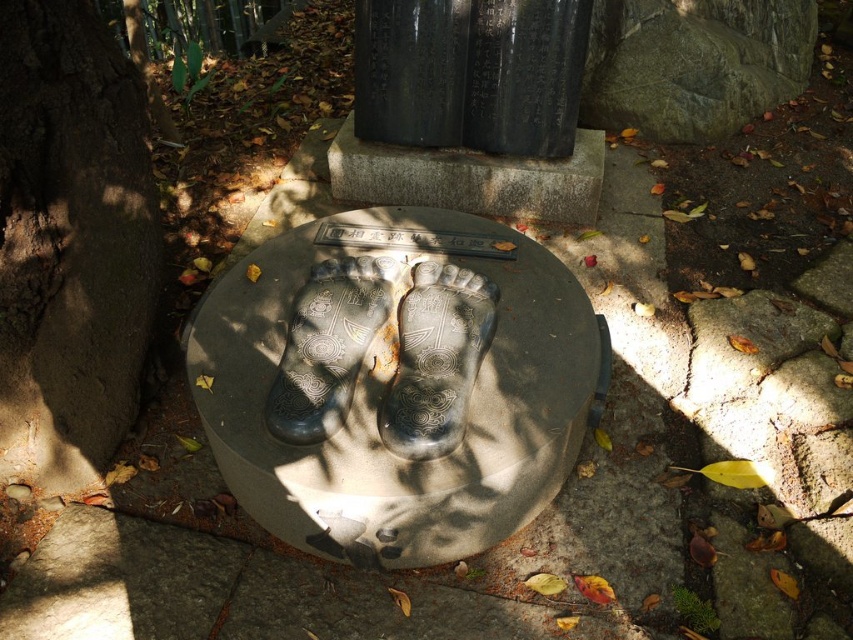
You are standing in the garden scene and want to take a closer look at the gray stone foot at center. If your arm is 0.7 meters long when extended, can you reach it by stretching your hand forward without moving your feet?

The gray stone foot at center is 1.70 meters away from you. Since your arm is only 0.7 meters long when extended, you cannot reach it without moving closer.

You are standing in a garden and see the gray stone foot at center and the black stone foot at center. Which one is closer to you?

The gray stone foot at center is closer to you because it is positioned in front of the black stone foot at center.

In the scene shown: You are standing in a garden and see two stone feet, the gray stone foot at center and the black stone foot at center. Which one is positioned to the right side?

The gray stone foot at center is positioned to the right of the black stone foot at center.